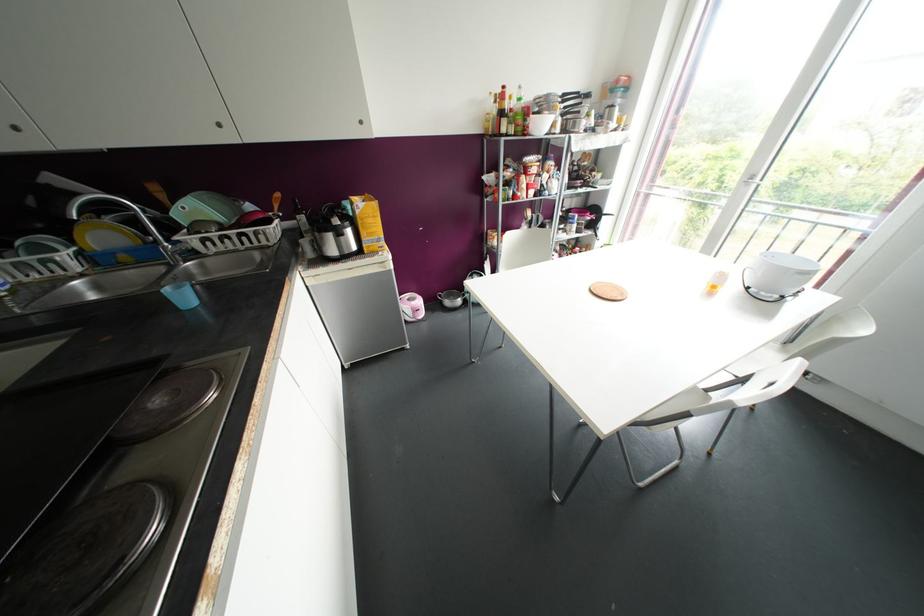
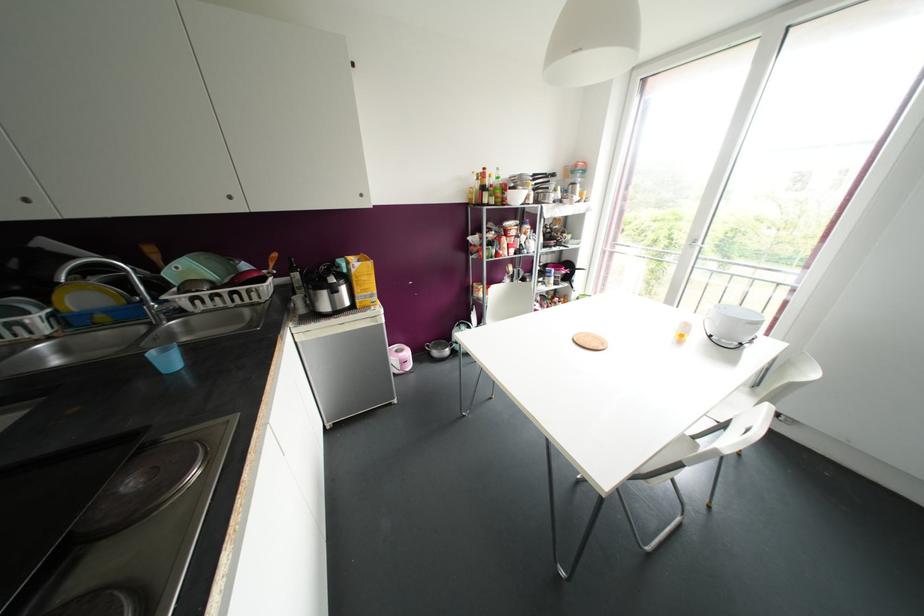
Question: How did the camera likely rotate?

Choices:
 (A) Left
 (B) Right
 (C) Up
 (D) Down

Answer: (C)